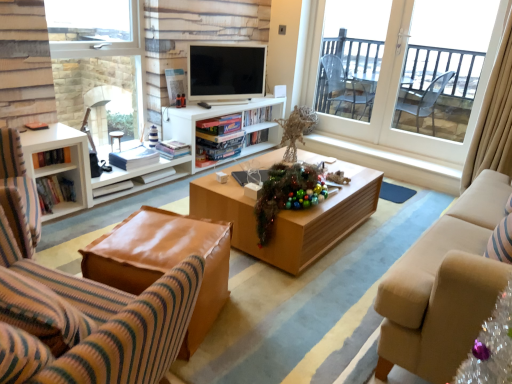
Question: From the image's perspective, would you say shiny metallic garland at center is shown under leather at left?

Choices:
 (A) yes
 (B) no

Answer: (B)

Question: Is shiny metallic garland at center to the right of leather at left from the viewer's perspective?

Choices:
 (A) no
 (B) yes

Answer: (B)

Question: Can you confirm if shiny metallic garland at center is bigger than leather at left?

Choices:
 (A) no
 (B) yes

Answer: (A)

Question: Is shiny metallic garland at center positioned beyond the bounds of leather at left?

Choices:
 (A) no
 (B) yes

Answer: (B)

Question: Can you confirm if shiny metallic garland at center is shorter than leather at left?

Choices:
 (A) no
 (B) yes

Answer: (B)

Question: Considering the relative sizes of shiny metallic garland at center and leather at left in the image provided, is shiny metallic garland at center thinner than leather at left?

Choices:
 (A) no
 (B) yes

Answer: (B)

Question: Can you confirm if matte white television at center is positioned to the right of leather ottoman at lower left?

Choices:
 (A) yes
 (B) no

Answer: (A)

Question: Considering the relative sizes of matte white television at center and leather ottoman at lower left in the image provided, is matte white television at center bigger than leather ottoman at lower left?

Choices:
 (A) no
 (B) yes

Answer: (A)

Question: Does matte white television at center have a greater height compared to leather ottoman at lower left?

Choices:
 (A) yes
 (B) no

Answer: (A)

Question: Is matte white television at center positioned beyond the bounds of leather ottoman at lower left?

Choices:
 (A) no
 (B) yes

Answer: (B)

Question: Are matte white television at center and leather ottoman at lower left making contact?

Choices:
 (A) no
 (B) yes

Answer: (A)

Question: Can you confirm if matte white television at center is wider than leather ottoman at lower left?

Choices:
 (A) yes
 (B) no

Answer: (B)

Question: Is clear glass window at left, acting as the second window starting from the right, not within white matte entertainment center at center?

Choices:
 (A) no
 (B) yes

Answer: (B)